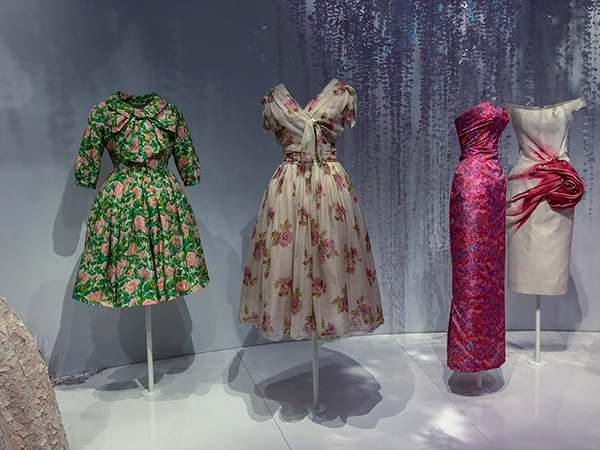
Find the location of `hanging beads`. hanging beads is located at coordinates (366, 36), (433, 31), (502, 36), (584, 47).